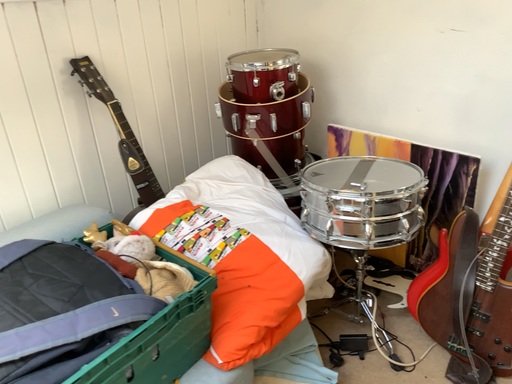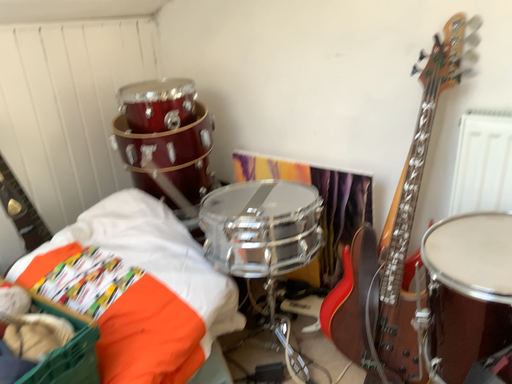
Question: Which way did the camera rotate in the video?

Choices:
 (A) rotated right
 (B) rotated left

Answer: (A)